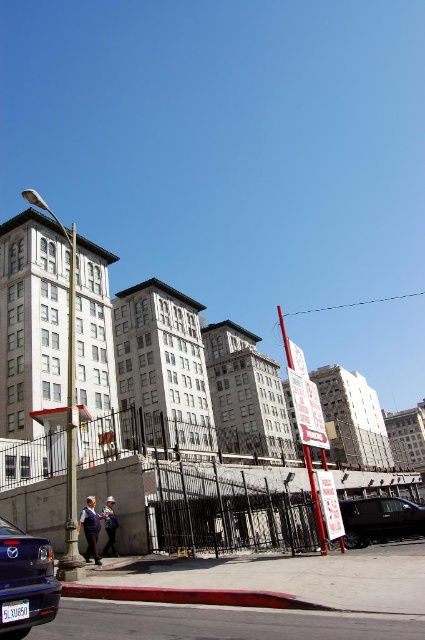
Does metallic blue sedan at lower left appear on the left side of white plastic license plate at lower center?

Indeed, metallic blue sedan at lower left is positioned on the left side of white plastic license plate at lower center.

Which is below, metallic blue sedan at lower left or white plastic license plate at lower center?

white plastic license plate at lower center is lower down.

Where is `metallic blue sedan at lower left`? metallic blue sedan at lower left is located at coordinates (25, 580).

Find the location of a particular element. This screenshot has width=425, height=640. metallic blue sedan at lower left is located at coordinates (25, 580).

Can you confirm if metallic blue sedan at lower left is thinner than shiny black van at lower right?

Yes, metallic blue sedan at lower left is thinner than shiny black van at lower right.

Can you confirm if metallic blue sedan at lower left is smaller than shiny black van at lower right?

Yes.

The width and height of the screenshot is (425, 640). Describe the element at coordinates (25, 580) in the screenshot. I see `metallic blue sedan at lower left` at that location.

Identify the location of metallic blue sedan at lower left. (25, 580).

Measure the distance between shiny black van at lower right and white plastic license plate at lower center.

A distance of 77.42 feet exists between shiny black van at lower right and white plastic license plate at lower center.

Who is lower down, shiny black van at lower right or white plastic license plate at lower center?

shiny black van at lower right is below.

At what (x,y) coordinates should I click in order to perform the action: click on shiny black van at lower right. Please return your answer as a coordinate pair (x, y). Looking at the image, I should click on (379, 520).

Identify the location of shiny black van at lower right. The image size is (425, 640). (379, 520).